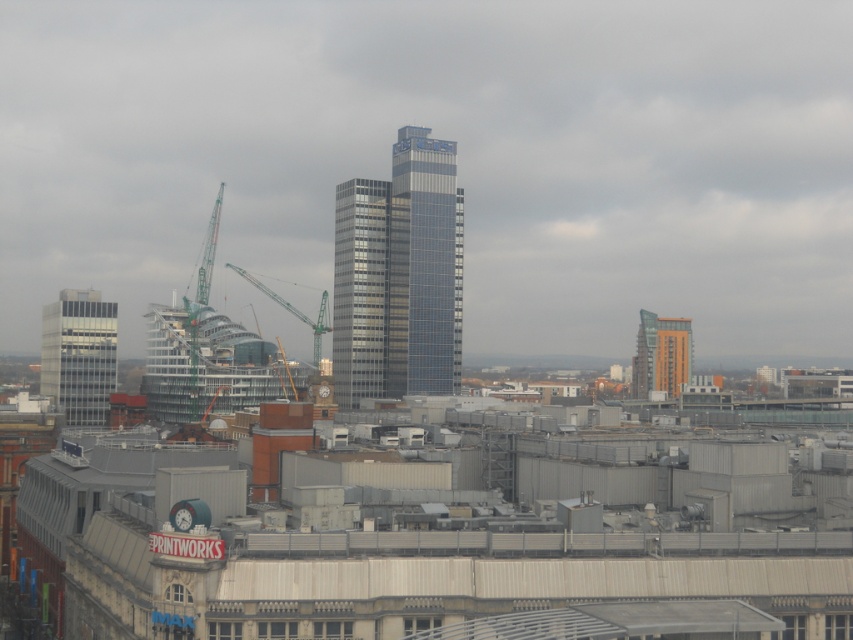
You are standing at the base of the glassy metallic skyscraper at center. You want to walk to the PRINTWORKS building in the foreground. Since the skyscraper is so tall, will you be able to see the PRINTWORKS building from where you are standing?

The glassy metallic skyscraper at center is 542.82 meters from viewer, so yes, you can see the PRINTWORKS building in the foreground because it is closer than the skyscraper.

You are standing in the city looking at the skyline. There are two points marked on the image, one at coordinates point (379, 323) and the other at point (685, 324). Which point is closer to you?

Point (379, 323) is closer to the viewer than point (685, 324).